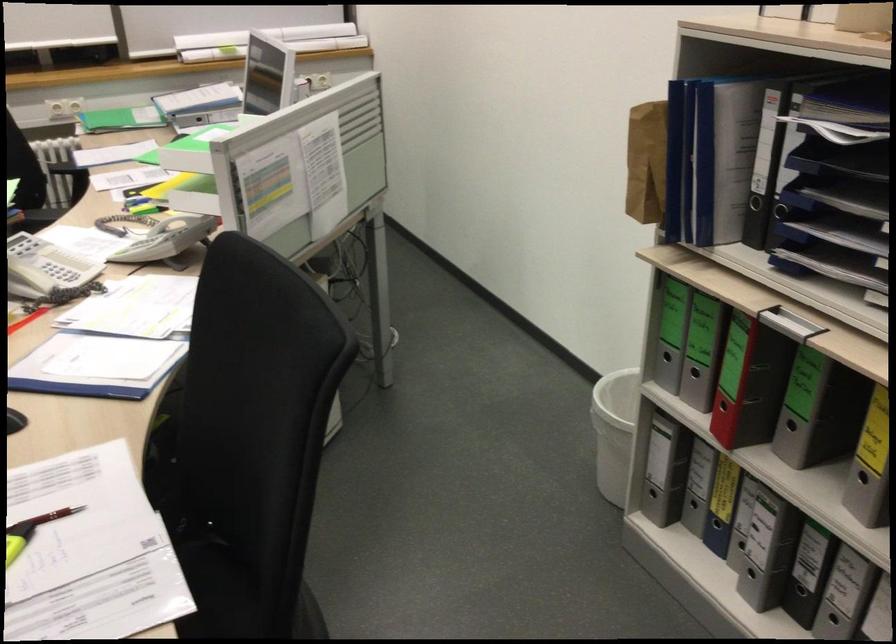
Locate an element on the screen. This screenshot has height=644, width=896. red binder finger hole is located at coordinates (721, 404).